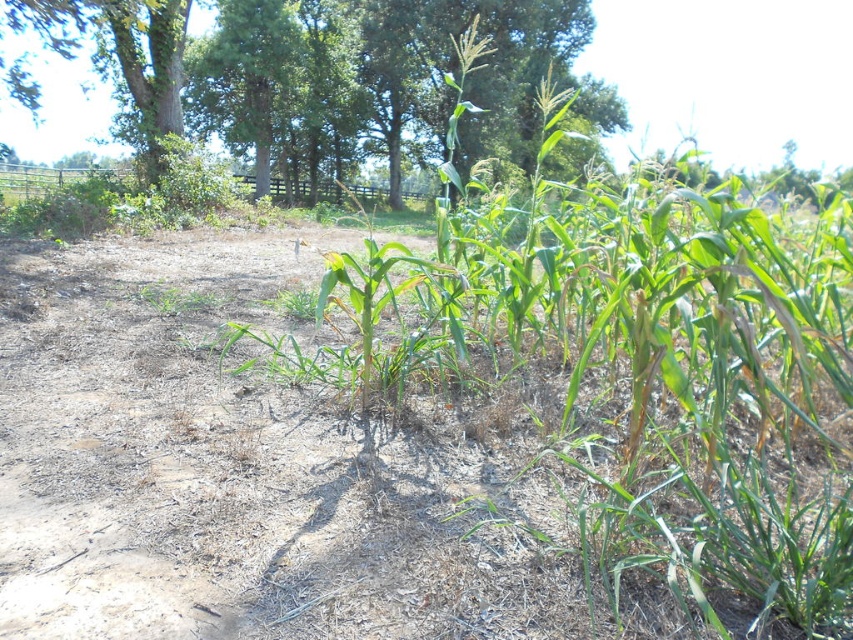
Is point (653, 296) in front of point (508, 22)?

Yes, point (653, 296) is closer to viewer.

Looking at this image, does green leafy corn at center lie in front of green leafy tree at upper center?

Yes, green leafy corn at center is in front of green leafy tree at upper center.

Does point (780, 340) lie in front of point (164, 33)?

That is True.

Where is `green leafy corn at center`? green leafy corn at center is located at coordinates (639, 369).